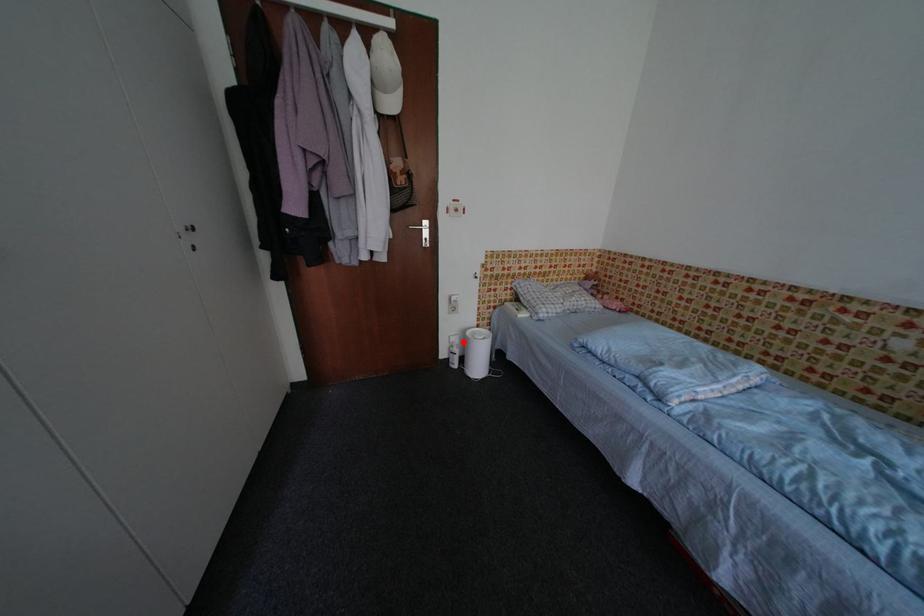
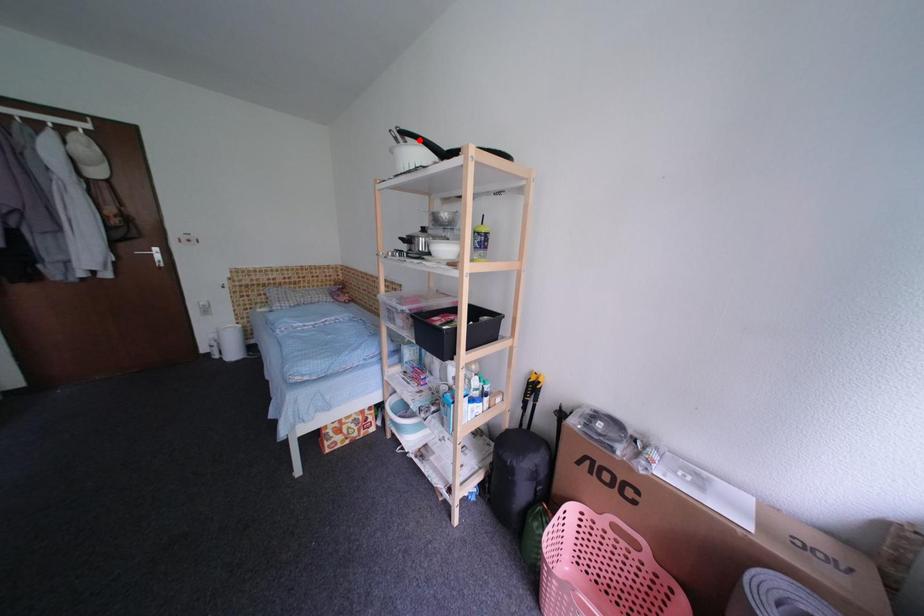
I am providing you with two images of the same scene from different viewpoints. A red point is marked on the first image and another point is marked on the second image. Is the red point in image1 aligned with the point shown in image2?

No